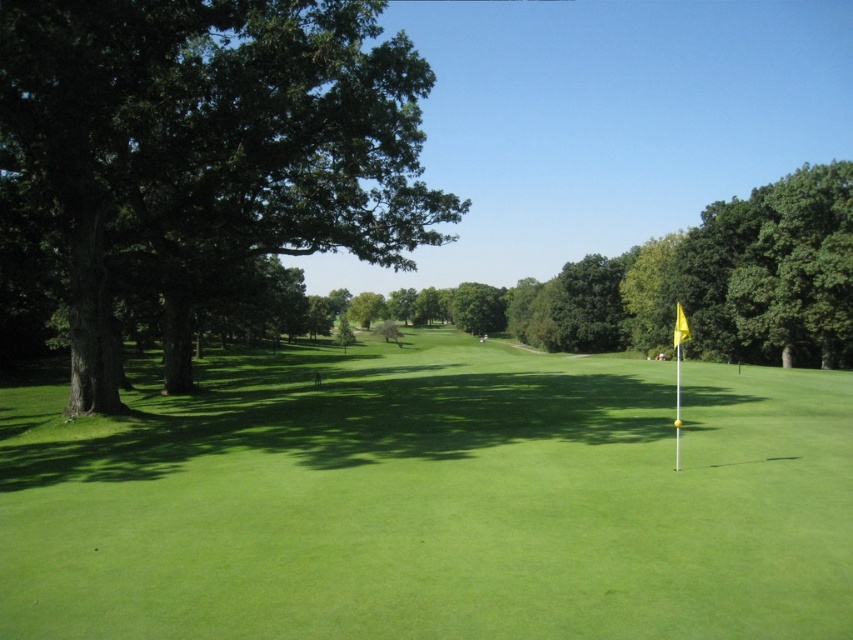
Question: Is the position of green grassy golf course at center more distant than that of yellow fabric flag at right?

Choices:
 (A) no
 (B) yes

Answer: (A)

Question: Is green grassy golf course at center thinner than dark green leafy tree at left?

Choices:
 (A) no
 (B) yes

Answer: (A)

Question: Among these points, which one is farthest from the camera?

Choices:
 (A) (166, 317)
 (B) (422, 403)

Answer: (A)

Question: Which object is positioned closest to the yellow fabric flag at right?

Choices:
 (A) green grassy golf course at center
 (B) green leafy tree at center

Answer: (A)

Question: Is green grassy golf course at center thinner than yellow fabric flag at right?

Choices:
 (A) no
 (B) yes

Answer: (A)

Question: Estimate the real-world distances between objects in this image. Which object is closer to the green grassy golf course at center?

Choices:
 (A) yellow fabric flag at right
 (B) dark green leafy tree at left

Answer: (B)